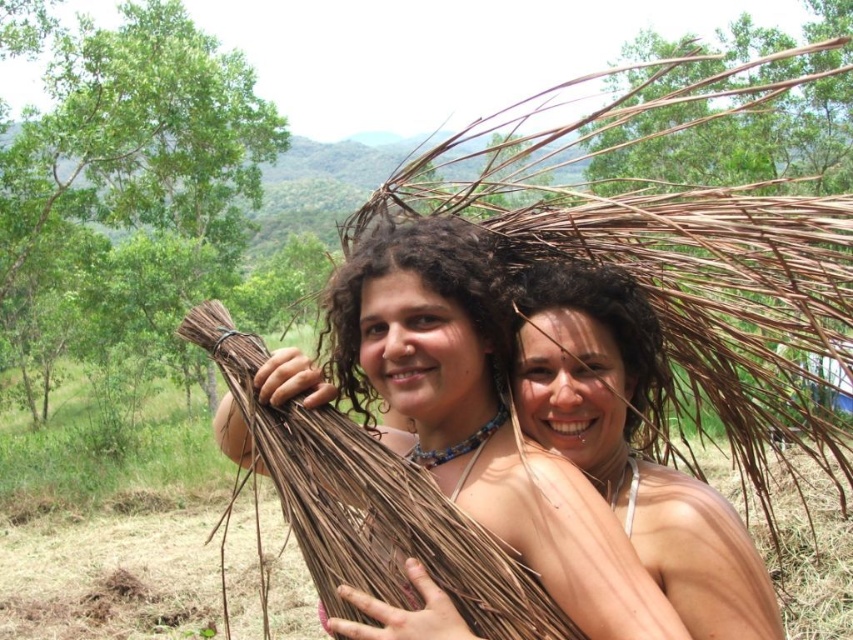
What are the coordinates of the dark curly hair at center?

The dark curly hair at center is located at point (426, 284).

You are a photographer taking a picture of the two people in the scene. You notice the brown natural fiber bundle at center and the dark brown hair at center. Which object is positioned lower in the image?

The brown natural fiber bundle at center is located below dark brown hair at center, so it is positioned lower in the image.

You are a photographer taking a picture of two people in a rural setting. You notice two individuals with dark curly hair at center and dark brown hair at center. Which person is positioned to the left side of the other?

The dark curly hair at center is to the left of dark brown hair at center.